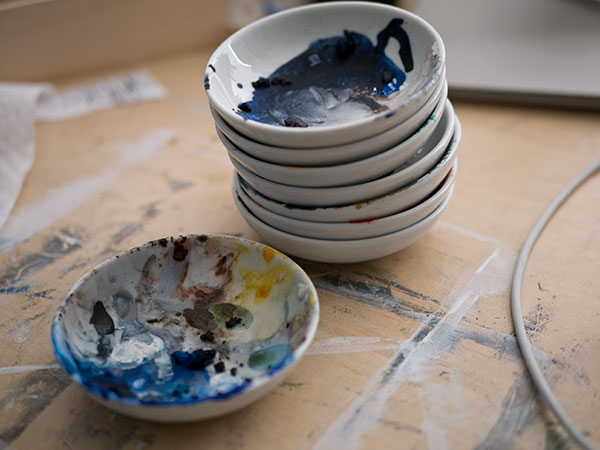
The height and width of the screenshot is (450, 600). I want to click on bottom dish in stack of dishes, so click(380, 254).